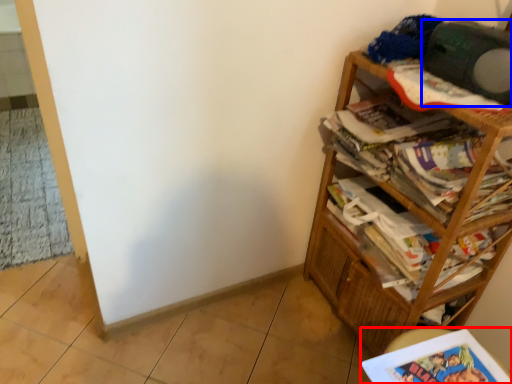
Question: Among these objects, which one is nearest to the camera, book (highlighted by a red box) or speaker (highlighted by a blue box)?

Choices:
 (A) book
 (B) speaker

Answer: (A)